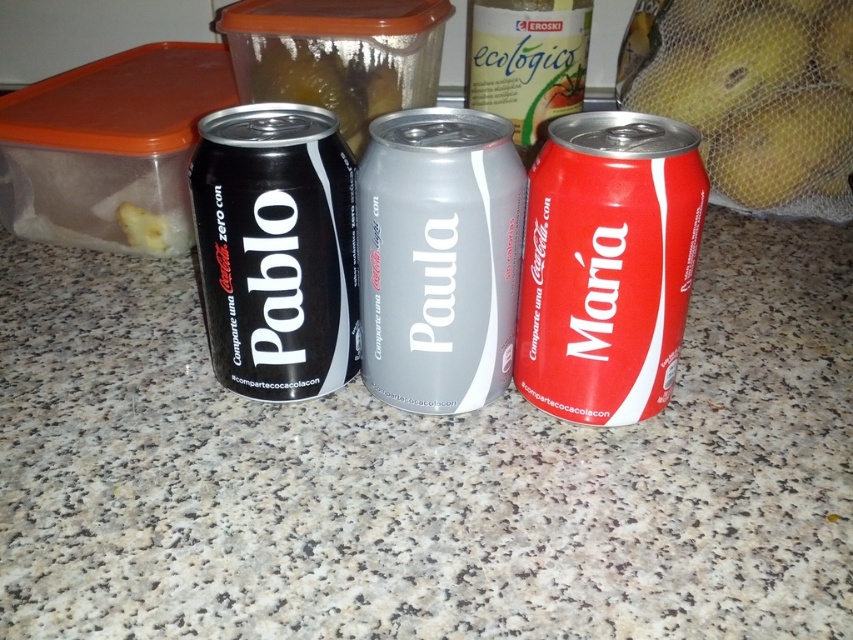
Based on the photo, you are organizing items on a kitchen counter and notice the yellow mesh bag at right and the red matte can at center. Which item is positioned lower on the counter?

The yellow mesh bag at right is positioned below the red matte can at center, so it is lower on the counter.

You are organizing cans on a shelf and need to know their sizes. Which can is taller between the satin silver can at center and the red matte can at center?

The satin silver can at center is taller than the red matte can at center according to the description.